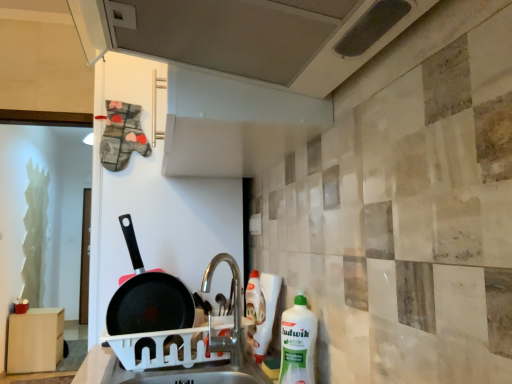
Identify the location of black non-stick frying pan at center. (147, 297).

Locate an element on the screen. Image resolution: width=512 pixels, height=384 pixels. light brown wood cabinet at lower left is located at coordinates (35, 340).

Describe the element at coordinates (35, 340) in the screenshot. This screenshot has height=384, width=512. I see `light brown wood cabinet at lower left` at that location.

Locate an element on the screen. white plastic sink at center is located at coordinates (191, 347).

Identify the location of silver metallic tap at center. (233, 313).

Considering the sizes of white plastic bottle at right and black non-stick frying pan at center in the image, is white plastic bottle at right taller or shorter than black non-stick frying pan at center?

Considering their sizes, white plastic bottle at right has less height than black non-stick frying pan at center.

Is white plastic bottle at right beside black non-stick frying pan at center?

No, white plastic bottle at right is not in contact with black non-stick frying pan at center.

Between point (307, 309) and point (123, 287), which one is positioned in front?

The point (307, 309) is in front.

Are white plastic bottle at right and white plastic dish rack at sink located far from each other?

Actually, white plastic bottle at right and white plastic dish rack at sink are a little close together.

Considering the sizes of objects white plastic bottle at right and white plastic dish rack at sink in the image provided, who is taller, white plastic bottle at right or white plastic dish rack at sink?

white plastic bottle at right is taller.

From a real-world perspective, who is located higher, white plastic bottle at right or white plastic dish rack at sink?

white plastic bottle at right is physically above.

From the image's perspective, which is below, white plastic bottle at right or white plastic dish rack at sink?

white plastic dish rack at sink, from the image's perspective.

In the scene shown: Is white plastic bottle at right turned away from silver metallic tap at center?

No.

From their relative heights in the image, would you say white plastic bottle at right is taller or shorter than silver metallic tap at center?

Considering their sizes, white plastic bottle at right has less height than silver metallic tap at center.

Would you say white plastic bottle at right is a long distance from silver metallic tap at center?

No, white plastic bottle at right is in close proximity to silver metallic tap at center.

Can you confirm if white plastic bottle at right is positioned to the left of silver metallic tap at center?

In fact, white plastic bottle at right is to the right of silver metallic tap at center.

Which of these two, silver metallic tap at center or white plastic bottle at right, is wider?

silver metallic tap at center.

At what (x,y) coordinates should I click in order to perform the action: click on tap lying behind the white plastic bottle at right. Please return your answer as a coordinate pair (x, y). Image resolution: width=512 pixels, height=384 pixels. Looking at the image, I should click on (233, 313).

Is white plastic bottle at right located within silver metallic tap at center?

Actually, white plastic bottle at right is outside silver metallic tap at center.

Between silver metallic tap at center and white plastic bottle at right, which one has larger size?

Bigger between the two is silver metallic tap at center.

This screenshot has width=512, height=384. Find the location of `cleaning product lying in front of the white plastic sink at center`. cleaning product lying in front of the white plastic sink at center is located at coordinates (298, 343).

Is white plastic bottle at right oriented away from white plastic sink at center?

No, white plastic sink at center is not at the back of white plastic bottle at right.

Can you tell me how much white plastic bottle at right and white plastic sink at center differ in facing direction?

The facing directions of white plastic bottle at right and white plastic sink at center are 5.52 degrees apart.

Considering the relative sizes of white plastic bottle at right and white plastic sink at center in the image provided, is white plastic bottle at right thinner than white plastic sink at center?

Correct, the width of white plastic bottle at right is less than that of white plastic sink at center.

Is light brown wood cabinet at lower left facing away from white plastic bottle at right?

light brown wood cabinet at lower left is not turned away from white plastic bottle at right.

Based on the photo, between light brown wood cabinet at lower left and white plastic bottle at right, which one has larger size?

With larger size is light brown wood cabinet at lower left.

What's the angular difference between light brown wood cabinet at lower left and white plastic bottle at right's facing directions?

178 degrees separate the facing orientations of light brown wood cabinet at lower left and white plastic bottle at right.

You are a GUI agent. You are given a task and a screenshot of the screen. Output one action in this format:
    pyautogui.click(x=<x>, y=<y>)
    Task: Click on the sink lying above the white plastic dish rack at sink (from the image's perspective)
    
    Given the screenshot: What is the action you would take?
    pyautogui.click(x=191, y=347)

From a real-world perspective, is white plastic dish rack at sink beneath white plastic sink at center?

Yes, from a real-world perspective, white plastic dish rack at sink is beneath white plastic sink at center.

Relative to white plastic sink at center, is white plastic dish rack at sink in front or behind?

white plastic dish rack at sink is in front of white plastic sink at center.

Is white plastic dish rack at sink oriented towards white plastic sink at center?

No.

In the image, there is a black non-stick frying pan at center. Where is `cleaning product below it (from a real-world perspective)`? The width and height of the screenshot is (512, 384). cleaning product below it (from a real-world perspective) is located at coordinates (298, 343).

Find the location of `cleaning product that appears above the white plastic dish rack at sink (from a real-world perspective)`. cleaning product that appears above the white plastic dish rack at sink (from a real-world perspective) is located at coordinates (298, 343).

Based on their spatial positions, is white plastic sink at center or black non-stick frying pan at center further from silver metallic tap at center?

black non-stick frying pan at center.

Estimate the real-world distances between objects in this image. Which object is further from silver metallic tap at center, light brown wood cabinet at lower left or metallic perforated exhaust hood at upper center?

light brown wood cabinet at lower left is further to silver metallic tap at center.

Based on their spatial positions, is black non-stick frying pan at center or white plastic bottle at right further from metallic perforated exhaust hood at upper center?

Among the two, black non-stick frying pan at center is located further to metallic perforated exhaust hood at upper center.

Estimate the real-world distances between objects in this image. Which object is further from white plastic dish rack at sink, metallic perforated exhaust hood at upper center or silver metallic tap at center?

metallic perforated exhaust hood at upper center is positioned further to the anchor white plastic dish rack at sink.

Which object lies further to the anchor point silver metallic tap at center, black non-stick frying pan at center or light brown wood cabinet at lower left?

light brown wood cabinet at lower left is positioned further to the anchor silver metallic tap at center.

When comparing their distances from white plastic bottle at right, does silver metallic tap at center or metallic perforated exhaust hood at upper center seem closer?

silver metallic tap at center is closer to white plastic bottle at right.

Consider the image. Based on their spatial positions, is light brown wood cabinet at lower left or silver metallic tap at center closer to black non-stick frying pan at center?

The object closer to black non-stick frying pan at center is silver metallic tap at center.

Based on their spatial positions, is white plastic sink at center or metallic perforated exhaust hood at upper center further from black non-stick frying pan at center?

Based on the image, metallic perforated exhaust hood at upper center appears to be further to black non-stick frying pan at center.

Find the location of a particular element. tap situated between black non-stick frying pan at center and white plastic bottle at right from left to right is located at coordinates (233, 313).

The width and height of the screenshot is (512, 384). Find the location of `frying pan between white plastic dish rack at sink and light brown wood cabinet at lower left along the z-axis`. frying pan between white plastic dish rack at sink and light brown wood cabinet at lower left along the z-axis is located at coordinates (147, 297).

Locate an element on the screen. Image resolution: width=512 pixels, height=384 pixels. frying pan between white plastic bottle at right and light brown wood cabinet at lower left in the front-back direction is located at coordinates (147, 297).

What are the coordinates of `frying pan that lies between metallic perforated exhaust hood at upper center and white plastic dish rack at sink from top to bottom` in the screenshot? It's located at 147,297.